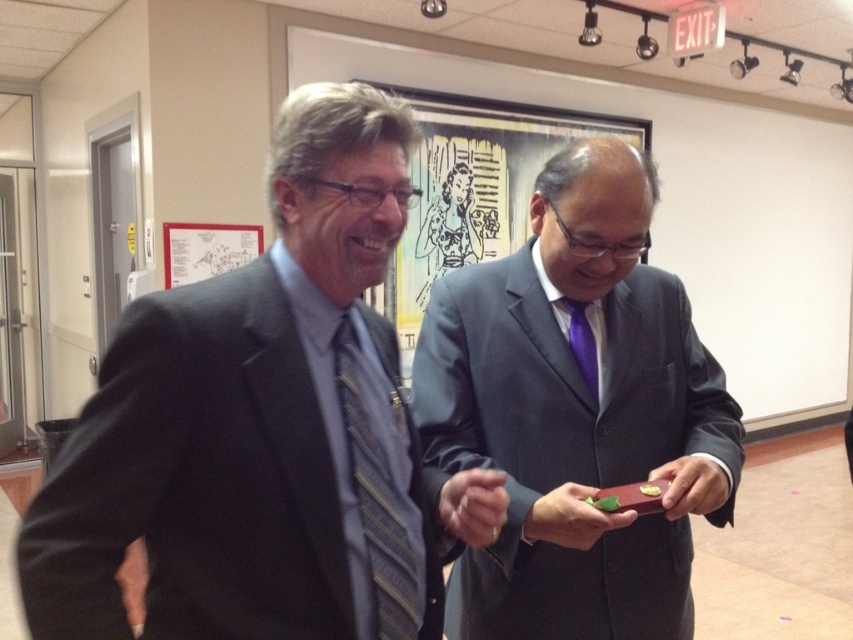
From the picture: Based on the scene description, what object is located at the coordinates point (254, 432)?

The object at point (254, 432) is the matte gray suit at left.

You are an interior designer observing the scene. You need to hang a picture that is 1.2 meters tall on the wall. The current space has the matte black framed artwork at center and the striped fabric tie at center. Which object can you use as a reference to ensure the new picture will fit vertically?

The matte black framed artwork at center is taller than the striped fabric tie at center. Since the new picture is 1.2 meters tall, you should compare its height to the matte black framed artwork at center to ensure it will fit vertically.

You are an event planner organizing a formal ceremony. You need to ensure that the matte gray suit at left and the striped fabric tie at center are visible to all attendees. Given their sizes, which object should you place closer to the front of the stage to ensure visibility?

The matte gray suit at left is larger than the striped fabric tie at center, so placing it closer to the front of the stage will ensure both objects are equally visible to the attendees.